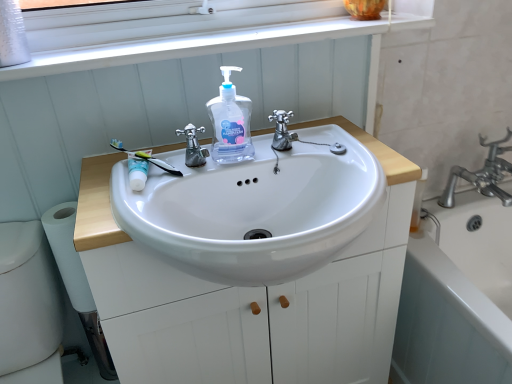
Question: Is polished chrome faucet at center, which is the 1th tap in right-to-left order, surrounded by polished chrome faucet at center, which is counted as the 1th tap, starting from the left?

Choices:
 (A) no
 (B) yes

Answer: (A)

Question: Considering the relative positions of polished chrome faucet at center, the second tap positioned from the right, and polished chrome faucet at center, which is the 1th tap in right-to-left order, in the image provided, is polished chrome faucet at center, the second tap positioned from the right, to the left of polished chrome faucet at center, which is the 1th tap in right-to-left order, from the viewer's perspective?

Choices:
 (A) no
 (B) yes

Answer: (B)

Question: Considering the relative positions of polished chrome faucet at center, which is counted as the 1th tap, starting from the left, and polished chrome faucet at center, which is the 1th tap in right-to-left order, in the image provided, is polished chrome faucet at center, which is counted as the 1th tap, starting from the left, to the right of polished chrome faucet at center, which is the 1th tap in right-to-left order, from the viewer's perspective?

Choices:
 (A) no
 (B) yes

Answer: (A)

Question: Considering the relative sizes of polished chrome faucet at center, the second tap positioned from the right, and polished chrome faucet at center, which is the 2th tap in left-to-right order, in the image provided, is polished chrome faucet at center, the second tap positioned from the right, wider than polished chrome faucet at center, which is the 2th tap in left-to-right order,?

Choices:
 (A) no
 (B) yes

Answer: (A)

Question: Does polished chrome faucet at center, which is counted as the 1th tap, starting from the left, have a lesser width compared to polished chrome faucet at center, which is the 1th tap in right-to-left order?

Choices:
 (A) no
 (B) yes

Answer: (B)

Question: From a real-world perspective, is polished chrome faucet at center, the second tap positioned from the right, located beneath polished chrome faucet at center, which is the 2th tap in left-to-right order?

Choices:
 (A) yes
 (B) no

Answer: (A)

Question: Is white glossy mouthwash at upper left completely or partially inside white matte cabinet at center?

Choices:
 (A) no
 (B) yes

Answer: (A)

Question: Does white matte cabinet at center touch white glossy mouthwash at upper left?

Choices:
 (A) no
 (B) yes

Answer: (A)

Question: Can you confirm if white matte cabinet at center is bigger than white glossy mouthwash at upper left?

Choices:
 (A) no
 (B) yes

Answer: (B)

Question: Is there a large distance between white matte cabinet at center and white glossy mouthwash at upper left?

Choices:
 (A) yes
 (B) no

Answer: (B)

Question: Is white matte cabinet at center facing towards white glossy mouthwash at upper left?

Choices:
 (A) no
 (B) yes

Answer: (A)

Question: Is white matte cabinet at center at the left side of white glossy mouthwash at upper left?

Choices:
 (A) yes
 (B) no

Answer: (B)

Question: Does white ceramic bathtub at lower right have a larger size compared to translucent plastic hand soap at center?

Choices:
 (A) yes
 (B) no

Answer: (A)